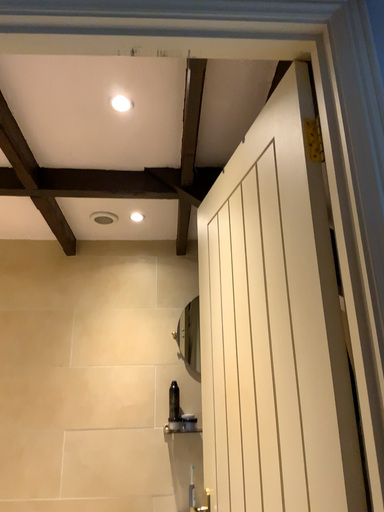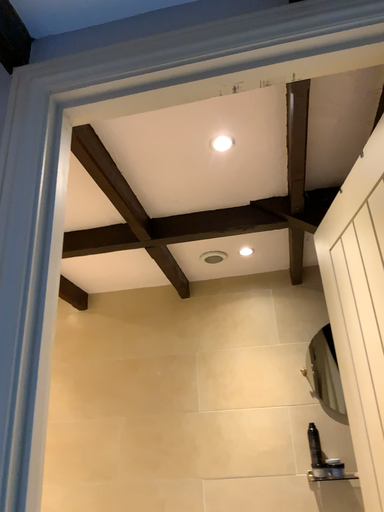
Question: How did the camera likely rotate when shooting the video?

Choices:
 (A) rotated left
 (B) rotated right

Answer: (A)